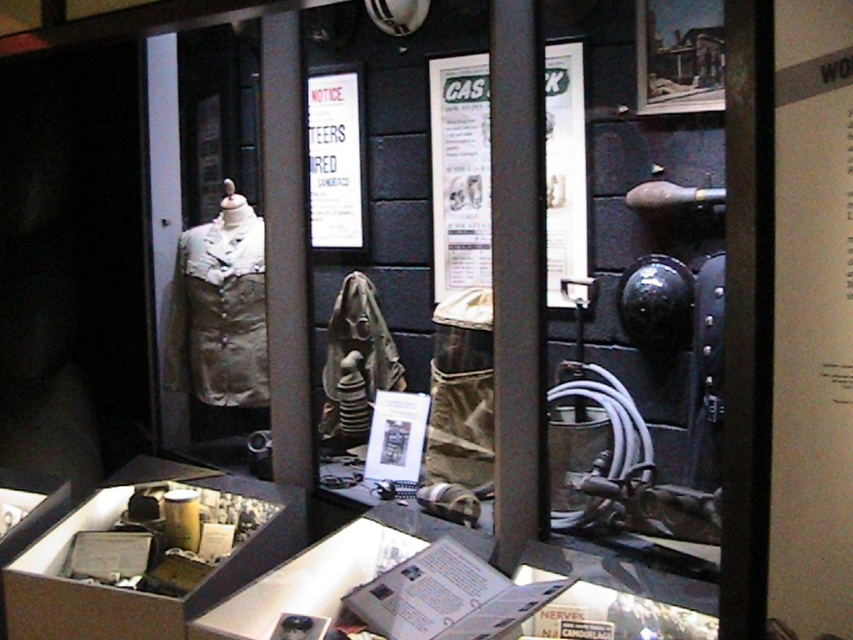
What are the coordinates of the white paper at center in the exhibit case?

The white paper at center is located at coordinates point (460, 172).